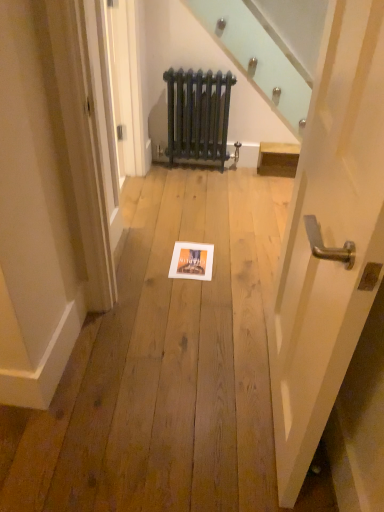
Question: Is dark blue cast iron radiator at center inside white glossy door handle at center right?

Choices:
 (A) no
 (B) yes

Answer: (A)

Question: Is white glossy door handle at center right at the left side of dark blue cast iron radiator at center?

Choices:
 (A) no
 (B) yes

Answer: (A)

Question: Is white glossy door handle at center right smaller than dark blue cast iron radiator at center?

Choices:
 (A) yes
 (B) no

Answer: (B)

Question: Considering the relative positions of white glossy door handle at center right and dark blue cast iron radiator at center in the image provided, is white glossy door handle at center right behind dark blue cast iron radiator at center?

Choices:
 (A) yes
 (B) no

Answer: (B)

Question: From the image's perspective, is white glossy door handle at center right on dark blue cast iron radiator at center?

Choices:
 (A) yes
 (B) no

Answer: (B)

Question: Does white glossy door handle at center right have a greater width compared to dark blue cast iron radiator at center?

Choices:
 (A) yes
 (B) no

Answer: (A)

Question: Does matte white picture frame at center lie behind dark blue cast iron radiator at center?

Choices:
 (A) yes
 (B) no

Answer: (B)

Question: Is matte white picture frame at center outside of dark blue cast iron radiator at center?

Choices:
 (A) no
 (B) yes

Answer: (B)

Question: Is matte white picture frame at center to the left of dark blue cast iron radiator at center from the viewer's perspective?

Choices:
 (A) no
 (B) yes

Answer: (B)

Question: Is dark blue cast iron radiator at center surrounded by matte white picture frame at center?

Choices:
 (A) yes
 (B) no

Answer: (B)

Question: Is matte white picture frame at center thinner than dark blue cast iron radiator at center?

Choices:
 (A) no
 (B) yes

Answer: (A)

Question: Is matte white picture frame at center taller than dark blue cast iron radiator at center?

Choices:
 (A) yes
 (B) no

Answer: (B)

Question: From a real-world perspective, does dark blue cast iron radiator at center stand above matte white picture frame at center?

Choices:
 (A) no
 (B) yes

Answer: (B)